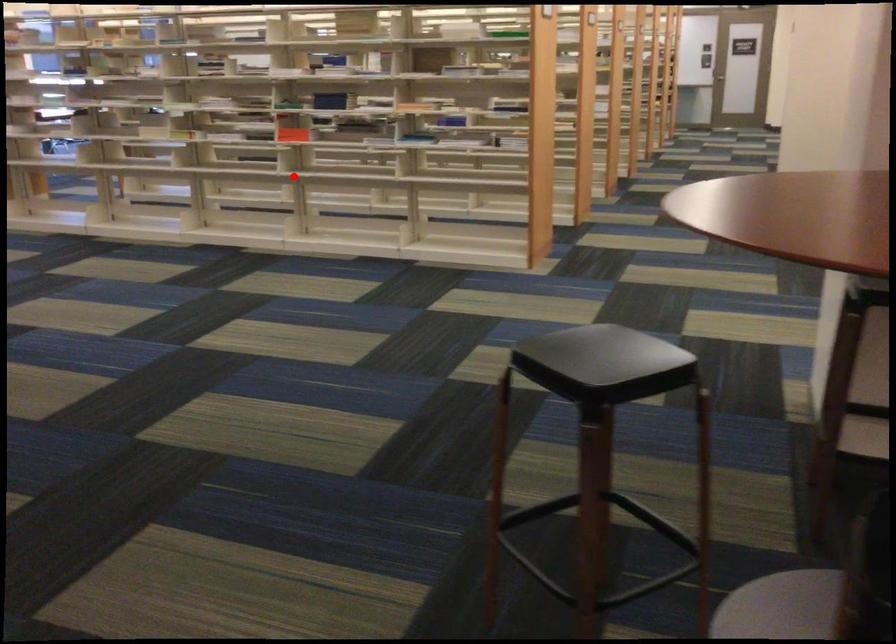
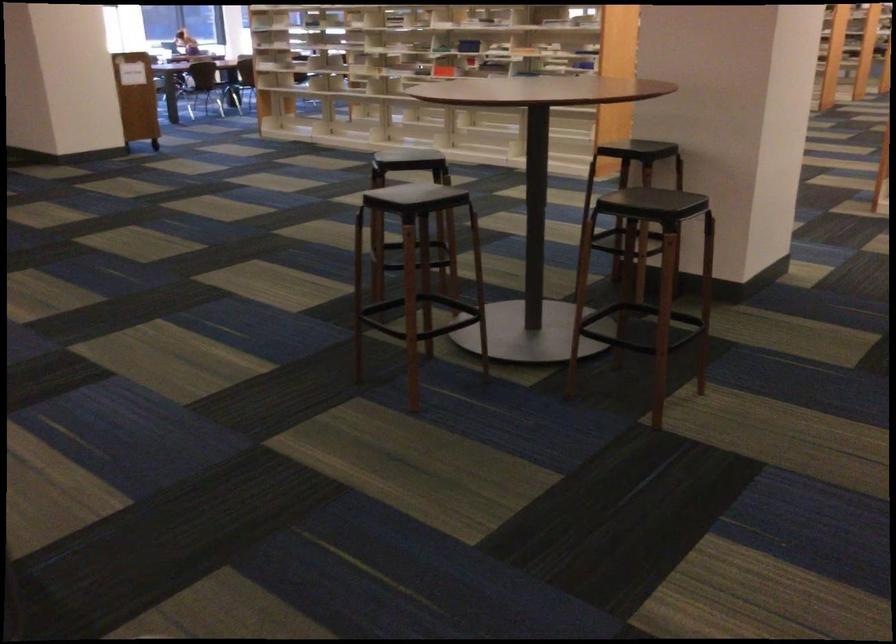
Question: I am providing you with two images of the same scene from different viewpoints. A red point is marked on the first image. At the location where the point appears in image 1, is it still visible in image 2?

Choices:
 (A) Yes
 (B) No

Answer: (A)